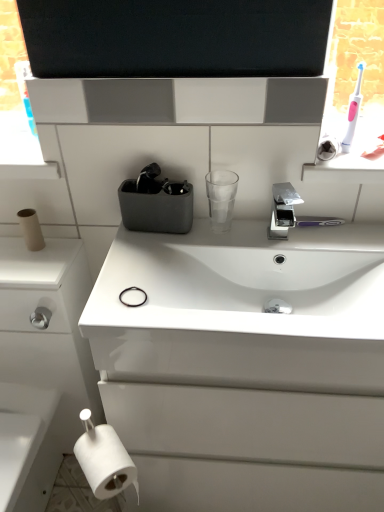
Question: Is chrome metallic faucet at center positioned far away from white glossy cabinet at lower left?

Choices:
 (A) no
 (B) yes

Answer: (A)

Question: Is white glossy cabinet at lower left at the back of chrome metallic faucet at center?

Choices:
 (A) no
 (B) yes

Answer: (A)

Question: Considering the relative positions of chrome metallic faucet at center and white glossy cabinet at lower left in the image provided, is chrome metallic faucet at center to the left of white glossy cabinet at lower left from the viewer's perspective?

Choices:
 (A) yes
 (B) no

Answer: (B)

Question: Considering the relative sizes of chrome metallic faucet at center and white glossy cabinet at lower left in the image provided, is chrome metallic faucet at center smaller than white glossy cabinet at lower left?

Choices:
 (A) yes
 (B) no

Answer: (A)

Question: Considering the relative positions of chrome metallic faucet at center and white glossy cabinet at lower left in the image provided, is chrome metallic faucet at center to the right of white glossy cabinet at lower left from the viewer's perspective?

Choices:
 (A) yes
 (B) no

Answer: (A)

Question: Is chrome metallic faucet at center further to camera compared to white glossy cabinet at lower left?

Choices:
 (A) no
 (B) yes

Answer: (B)

Question: From a real-world perspective, is white matte toilet paper at lower left, which is the 1th toilet paper from front to back, positioned over pink plastic toothbrush at upper right based on gravity?

Choices:
 (A) no
 (B) yes

Answer: (A)

Question: From a real-world perspective, does white matte toilet paper at lower left, placed as the second toilet paper when sorted from left to right, sit lower than pink plastic toothbrush at upper right?

Choices:
 (A) yes
 (B) no

Answer: (A)

Question: Is white matte toilet paper at lower left, marked as the first toilet paper in a right-to-left arrangement, further to the viewer compared to pink plastic toothbrush at upper right?

Choices:
 (A) yes
 (B) no

Answer: (B)

Question: Can you confirm if white matte toilet paper at lower left, which is the 1th toilet paper from front to back, is taller than pink plastic toothbrush at upper right?

Choices:
 (A) yes
 (B) no

Answer: (B)

Question: Can you confirm if white matte toilet paper at lower left, marked as the first toilet paper in a right-to-left arrangement, is bigger than pink plastic toothbrush at upper right?

Choices:
 (A) yes
 (B) no

Answer: (A)

Question: From the image's perspective, is white matte toilet paper at lower left, marked as the first toilet paper in a right-to-left arrangement, over pink plastic toothbrush at upper right?

Choices:
 (A) yes
 (B) no

Answer: (B)

Question: Is pink plastic toothbrush at upper right thinner than chrome metallic faucet at center?

Choices:
 (A) yes
 (B) no

Answer: (A)